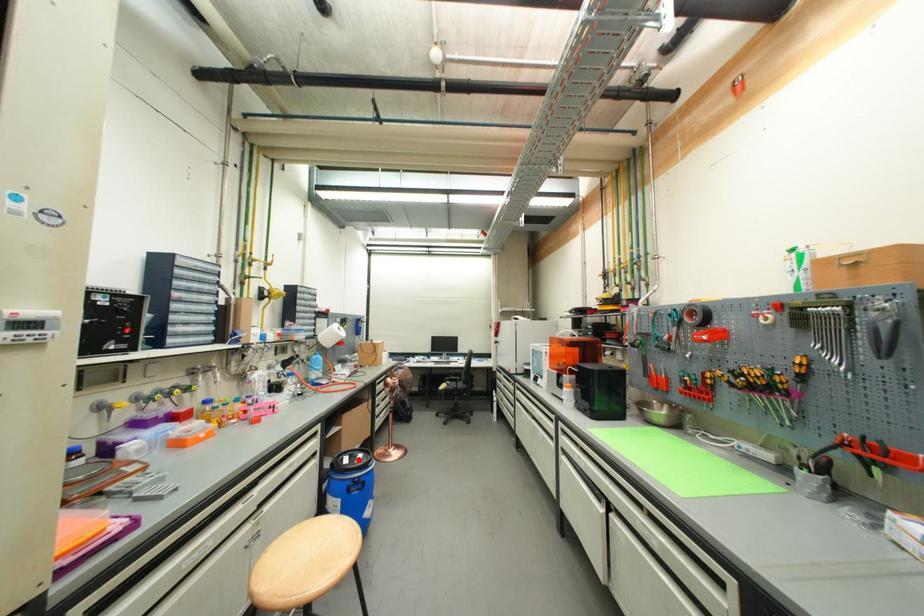
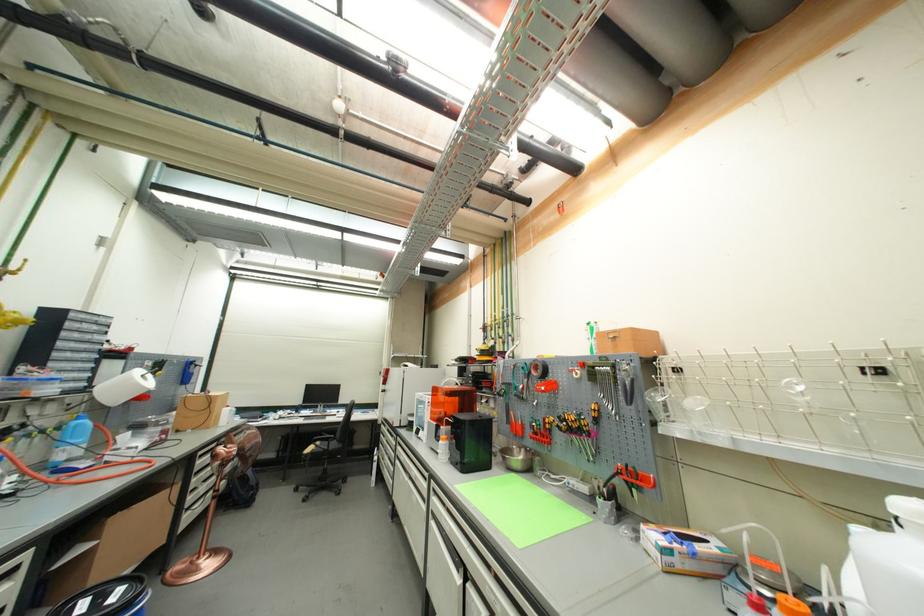
Question: I am providing you with two images of the same scene from different viewpoints. A red point is marked on the first image. Is the red point's position out of view in image 2?

Choices:
 (A) Yes
 (B) No

Answer: (B)